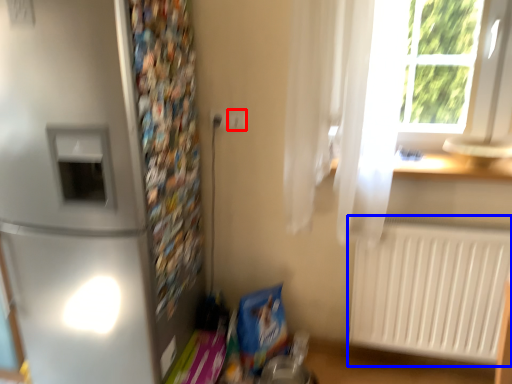
Question: Among these objects, which one is farthest to the camera, electric outlet (highlighted by a red box) or radiator (highlighted by a blue box)?

Choices:
 (A) electric outlet
 (B) radiator

Answer: (A)